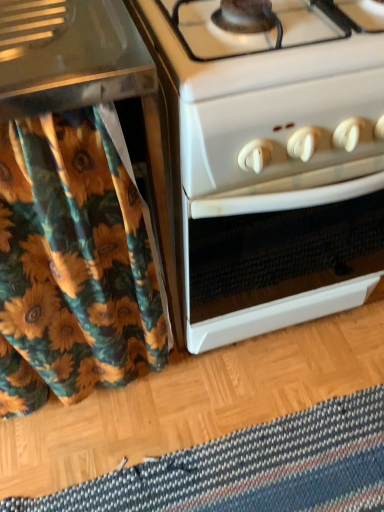
Question: Is floral fabric shower curtain at left smaller than striped woolen mat at lower center?

Choices:
 (A) no
 (B) yes

Answer: (A)

Question: Is floral fabric shower curtain at left located outside striped woolen mat at lower center?

Choices:
 (A) yes
 (B) no

Answer: (A)

Question: Can striped woolen mat at lower center be found inside floral fabric shower curtain at left?

Choices:
 (A) no
 (B) yes

Answer: (A)

Question: Is floral fabric shower curtain at left to the right of striped woolen mat at lower center from the viewer's perspective?

Choices:
 (A) no
 (B) yes

Answer: (A)

Question: Is floral fabric shower curtain at left bigger than striped woolen mat at lower center?

Choices:
 (A) no
 (B) yes

Answer: (B)

Question: From a real-world perspective, is striped woolen mat at lower center positioned above or below floral fabric shower curtain at left?

Choices:
 (A) above
 (B) below

Answer: (B)

Question: Looking at their shapes, would you say striped woolen mat at lower center is wider or thinner than floral fabric shower curtain at left?

Choices:
 (A) thin
 (B) wide

Answer: (B)

Question: From the image's perspective, is striped woolen mat at lower center positioned above or below floral fabric shower curtain at left?

Choices:
 (A) below
 (B) above

Answer: (A)

Question: Based on their sizes in the image, would you say striped woolen mat at lower center is bigger or smaller than floral fabric shower curtain at left?

Choices:
 (A) big
 (B) small

Answer: (B)

Question: Is striped woolen mat at lower center to the left or to the right of white glossy oven at center in the image?

Choices:
 (A) left
 (B) right

Answer: (A)

Question: Do you think striped woolen mat at lower center is within white glossy oven at center, or outside of it?

Choices:
 (A) inside
 (B) outside

Answer: (B)

Question: Considering the positions of point (347, 471) and point (271, 273), is point (347, 471) closer or farther from the camera than point (271, 273)?

Choices:
 (A) farther
 (B) closer

Answer: (A)

Question: From a real-world perspective, relative to white glossy oven at center, is striped woolen mat at lower center vertically above or below?

Choices:
 (A) below
 (B) above

Answer: (A)

Question: In the image, is floral fabric shower curtain at left on the left side or the right side of white glossy oven at center?

Choices:
 (A) left
 (B) right

Answer: (A)

Question: Choose the correct answer: Is floral fabric shower curtain at left inside white glossy oven at center or outside it?

Choices:
 (A) outside
 (B) inside

Answer: (A)